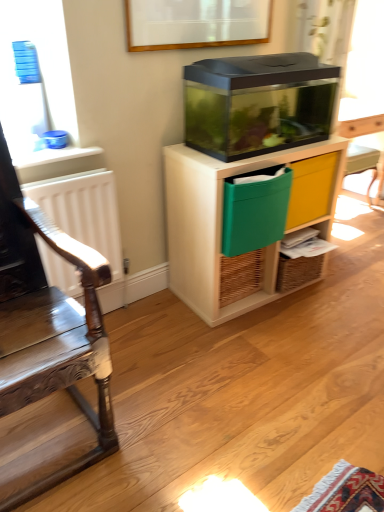
Identify the location of vacant area that lies between wooden polished chair at left and transparent plastic cabinet at center. The image size is (384, 512). (180, 348).